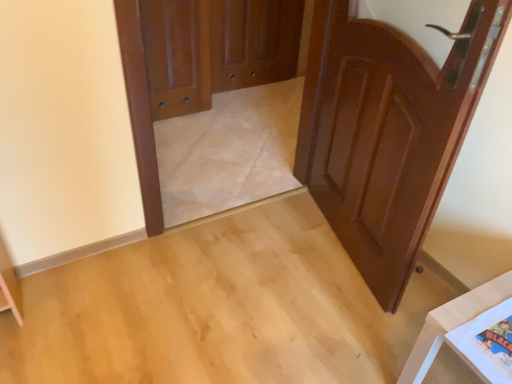
Question: Would you say brown wooden screen door at center is to the left or to the right of shiny brown door at right, the first door positioned from the front, in the picture?

Choices:
 (A) left
 (B) right

Answer: (A)

Question: Considering the positions of brown wooden screen door at center and shiny brown door at right, the 2th door in the back-to-front sequence, in the image, is brown wooden screen door at center taller or shorter than shiny brown door at right, the 2th door in the back-to-front sequence,?

Choices:
 (A) tall
 (B) short

Answer: (B)

Question: Which is farther from the polished wood door at upper left, placed as the second door when sorted from front to back?

Choices:
 (A) shiny brown door at right, the 2th door in the back-to-front sequence
 (B) brown wooden screen door at center
 (C) white glossy table at lower right

Answer: (C)

Question: Estimate the real-world distances between objects in this image. Which object is farther from the polished wood door at upper left, which is the first door from left to right?

Choices:
 (A) white glossy table at lower right
 (B) brown wooden screen door at center
 (C) shiny brown door at right, the 2th door in the back-to-front sequence

Answer: (A)